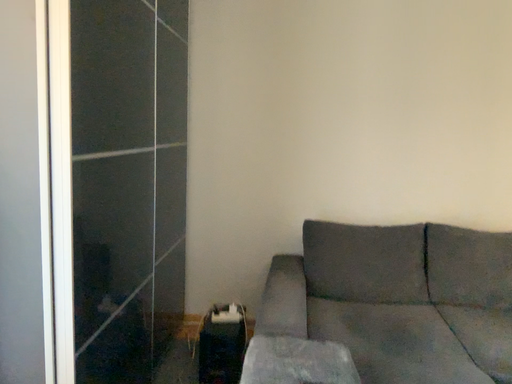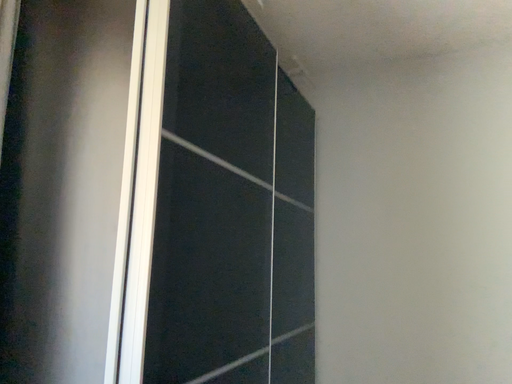
Question: Which way did the camera rotate in the video?

Choices:
 (A) rotated upward
 (B) rotated downward

Answer: (A)